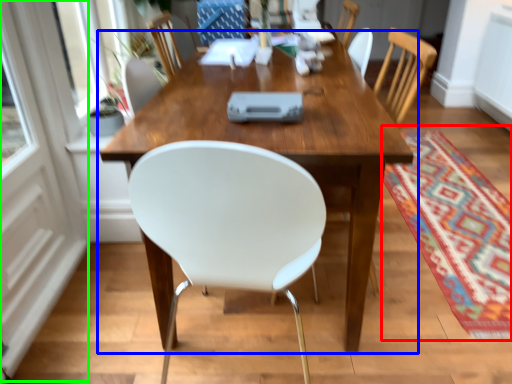
Question: Based on their relative distances, which object is nearer to mat (highlighted by a red box)? Choose from table (highlighted by a blue box) and screen door (highlighted by a green box).

Choices:
 (A) table
 (B) screen door

Answer: (A)